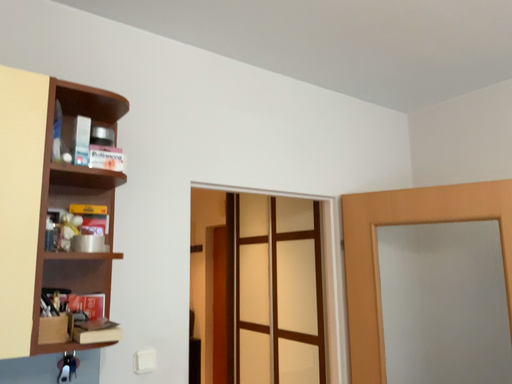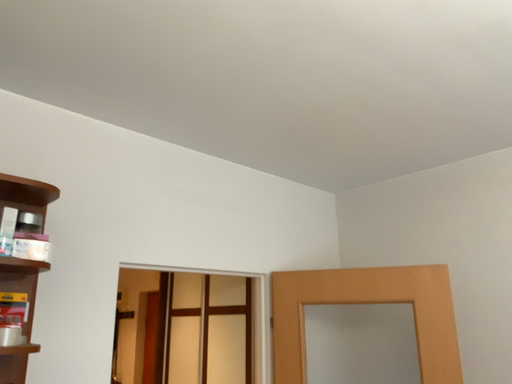
Question: Which way did the camera rotate in the video?

Choices:
 (A) rotated left
 (B) rotated right

Answer: (B)